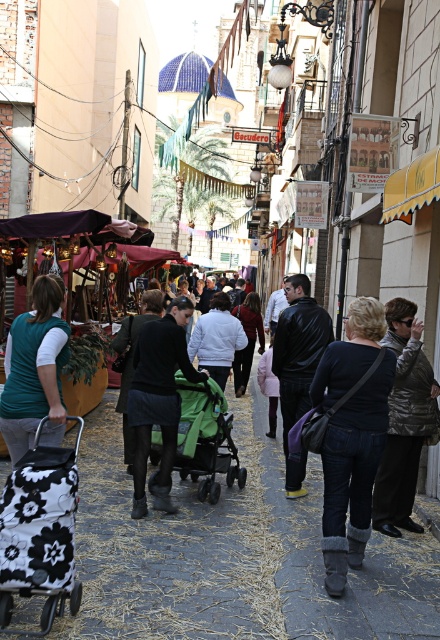
You are a traveler who wants to buy a jacket. You see a shiny silver jacket at right and a leather jacket at center. Which one is smaller in size?

The shiny silver jacket at right has a smaller size compared to the leather jacket at center.

Please look at the shiny silver jacket at right. There is a point at coordinate (403, 420). Where exactly is this point located on the shiny silver jacket at right?

The point at coordinate (403, 420) is located on the shiny silver jacket at right.

You are a tourist walking down the street and want to pick up the shiny silver jacket at right and the green fabric stroller at center. Which one do you need to walk towards first?

The shiny silver jacket at right is closer to the viewer than the green fabric stroller at center, so you should walk towards the shiny silver jacket at right first.